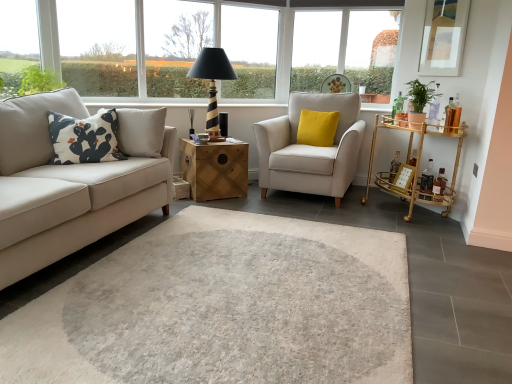
Question: In which direction should I rotate to look at black striped wood table lamp at upper center?

Choices:
 (A) right
 (B) left

Answer: (B)

Question: Should I look upward or downward to see transparent glass window at upper left, which appears as the 2th window when viewed from the back?

Choices:
 (A) down
 (B) up

Answer: (B)

Question: From a real-world perspective, is yellow velvet cushion at center, which is the second pillow in left-to-right order, on matte white frame at upper right?

Choices:
 (A) no
 (B) yes

Answer: (A)

Question: Is yellow velvet cushion at center, arranged as the first pillow when viewed from the right, taller than matte white frame at upper right?

Choices:
 (A) yes
 (B) no

Answer: (B)

Question: Considering the relative sizes of yellow velvet cushion at center, which is the second pillow in left-to-right order, and matte white frame at upper right in the image provided, is yellow velvet cushion at center, which is the second pillow in left-to-right order, smaller than matte white frame at upper right?

Choices:
 (A) yes
 (B) no

Answer: (B)

Question: Is yellow velvet cushion at center, arranged as the 2th pillow when viewed from the front, further to camera compared to matte white frame at upper right?

Choices:
 (A) yes
 (B) no

Answer: (A)

Question: Can you confirm if yellow velvet cushion at center, arranged as the 2th pillow when viewed from the front, is wider than matte white frame at upper right?

Choices:
 (A) yes
 (B) no

Answer: (A)

Question: Is yellow velvet cushion at center, the first pillow positioned from the back, shorter than matte white frame at upper right?

Choices:
 (A) yes
 (B) no

Answer: (A)

Question: Can wooden chest at center, the first table from the left, be found inside gold bamboo bar cart at right, positioned as the second table in left-to-right order?

Choices:
 (A) yes
 (B) no

Answer: (B)

Question: Considering the relative sizes of gold bamboo bar cart at right, the first table from the right, and wooden chest at center, the first table from the left, in the image provided, is gold bamboo bar cart at right, the first table from the right, wider than wooden chest at center, the first table from the left,?

Choices:
 (A) no
 (B) yes

Answer: (A)

Question: Is gold bamboo bar cart at right, positioned as the second table in left-to-right order, closer to the viewer compared to wooden chest at center, the 2th table from the right?

Choices:
 (A) yes
 (B) no

Answer: (A)

Question: Considering the relative sizes of gold bamboo bar cart at right, positioned as the second table in left-to-right order, and wooden chest at center, the first table from the left, in the image provided, is gold bamboo bar cart at right, positioned as the second table in left-to-right order, shorter than wooden chest at center, the first table from the left,?

Choices:
 (A) yes
 (B) no

Answer: (B)

Question: Is gold bamboo bar cart at right, positioned as the second table in left-to-right order, taller than wooden chest at center, the first table from the left?

Choices:
 (A) no
 (B) yes

Answer: (B)

Question: Is gold bamboo bar cart at right, positioned as the second table in left-to-right order, to the right of wooden chest at center, the first table from the left, from the viewer's perspective?

Choices:
 (A) no
 (B) yes

Answer: (B)

Question: Does transparent glass window at upper left, arranged as the 1th window when viewed from the front, have a larger size compared to yellow velvet cushion at center, the first pillow positioned from the back?

Choices:
 (A) yes
 (B) no

Answer: (B)